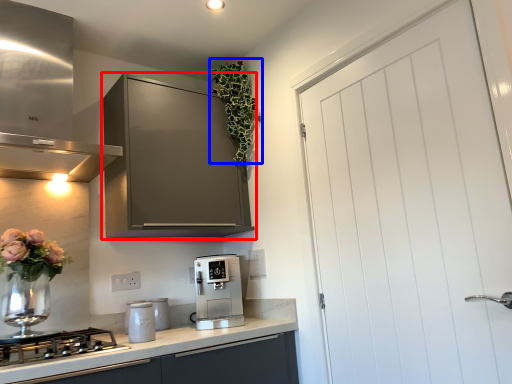
Question: Which object appears closest to the camera in this image, cabinetry (highlighted by a red box) or floral arrangement (highlighted by a blue box)?

Choices:
 (A) cabinetry
 (B) floral arrangement

Answer: (A)